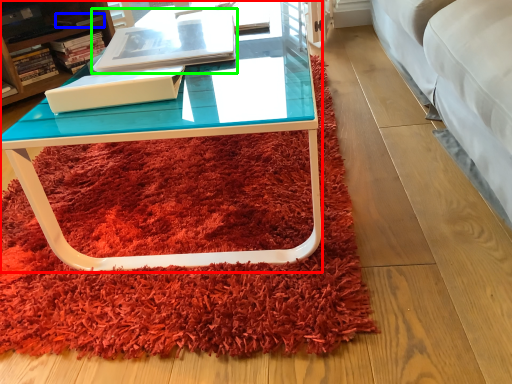
Question: Estimate the real-world distances between objects in this image. Which object is closer to coffee table (highlighted by a red box), book (highlighted by a blue box) or book (highlighted by a green box)?

Choices:
 (A) book
 (B) book

Answer: (B)